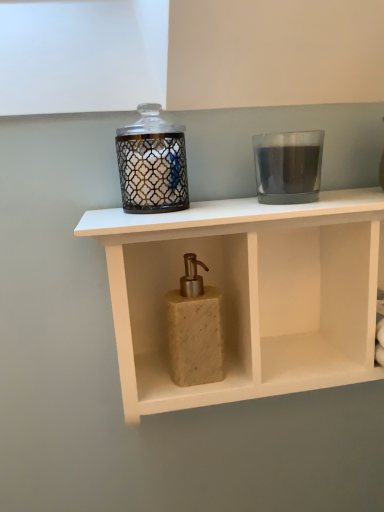
Question: Is transparent glass candle at upper right, the second candle holder positioned from the left, not inside matte glass candle holder at upper center, which is counted as the 2th candle holder, starting from the right?

Choices:
 (A) no
 (B) yes

Answer: (B)

Question: Is transparent glass candle at upper right, placed as the 1th candle holder when sorted from right to left, positioned with its back to matte glass candle holder at upper center, which is counted as the 2th candle holder, starting from the right?

Choices:
 (A) no
 (B) yes

Answer: (A)

Question: Is the position of transparent glass candle at upper right, placed as the 1th candle holder when sorted from right to left, more distant than that of matte glass candle holder at upper center, which is counted as the 2th candle holder, starting from the right?

Choices:
 (A) no
 (B) yes

Answer: (B)

Question: Is transparent glass candle at upper right, placed as the 1th candle holder when sorted from right to left, at the left side of matte glass candle holder at upper center, which is the first candle holder in left-to-right order?

Choices:
 (A) no
 (B) yes

Answer: (A)

Question: Could you tell me if transparent glass candle at upper right, placed as the 1th candle holder when sorted from right to left, is turned towards matte glass candle holder at upper center, which is counted as the 2th candle holder, starting from the right?

Choices:
 (A) no
 (B) yes

Answer: (A)

Question: Are transparent glass candle at upper right, the second candle holder positioned from the left, and matte glass candle holder at upper center, which is counted as the 2th candle holder, starting from the right, located far from each other?

Choices:
 (A) yes
 (B) no

Answer: (B)

Question: From the image's perspective, would you say beige stone soap dispenser at center is shown under beige stone soap dispenser at center?

Choices:
 (A) yes
 (B) no

Answer: (A)

Question: Is the position of beige stone soap dispenser at center more distant than that of beige stone soap dispenser at center?

Choices:
 (A) yes
 (B) no

Answer: (B)

Question: From a real-world perspective, is beige stone soap dispenser at center under beige stone soap dispenser at center?

Choices:
 (A) no
 (B) yes

Answer: (B)

Question: From a real-world perspective, is beige stone soap dispenser at center on top of beige stone soap dispenser at center?

Choices:
 (A) yes
 (B) no

Answer: (B)

Question: Considering the relative positions of beige stone soap dispenser at center and beige stone soap dispenser at center in the image provided, is beige stone soap dispenser at center to the left of beige stone soap dispenser at center from the viewer's perspective?

Choices:
 (A) yes
 (B) no

Answer: (B)

Question: Could you tell me if beige stone soap dispenser at center is facing beige stone soap dispenser at center?

Choices:
 (A) no
 (B) yes

Answer: (B)

Question: Does beige stone soap dispenser at center appear on the left side of transparent glass candle at upper right, placed as the 1th candle holder when sorted from right to left?

Choices:
 (A) no
 (B) yes

Answer: (B)